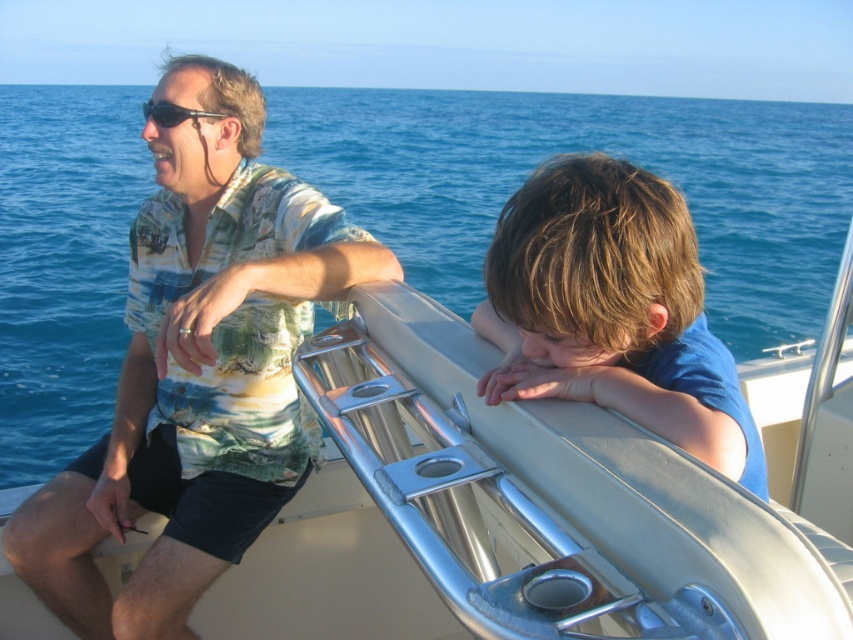
Who is positioned more to the left, blue water at upper center or matte black sunglasses at upper left?

Positioned to the left is blue water at upper center.

Does blue water at upper center have a lesser width compared to matte black sunglasses at upper left?

Incorrect, blue water at upper center's width is not less than matte black sunglasses at upper left's.

Does point (454, 268) lie in front of point (141, 104)?

Yes, it is.

Image resolution: width=853 pixels, height=640 pixels. Identify the location of blue water at upper center. (581, 150).

Is blue matte shirt at right bigger than matte black sunglasses at upper left?

No, blue matte shirt at right is not bigger than matte black sunglasses at upper left.

Does point (517, 292) come in front of point (167, 124)?

Yes, it is.

I want to click on blue matte shirt at right, so click(x=612, y=310).

How much distance is there between blue water at upper center and blue matte shirt at right?

blue water at upper center is 5.89 meters away from blue matte shirt at right.

Who is more forward, [0,102] or [693,449]?

Point [693,449]

Identify the location of blue water at upper center. coord(581,150).

You are a GUI agent. You are given a task and a screenshot of the screen. Output one action in this format:
    pyautogui.click(x=<x>, y=<y>)
    Task: Click on the blue water at upper center
    This screenshot has height=640, width=853.
    Given the screenshot: What is the action you would take?
    pyautogui.click(x=581, y=150)